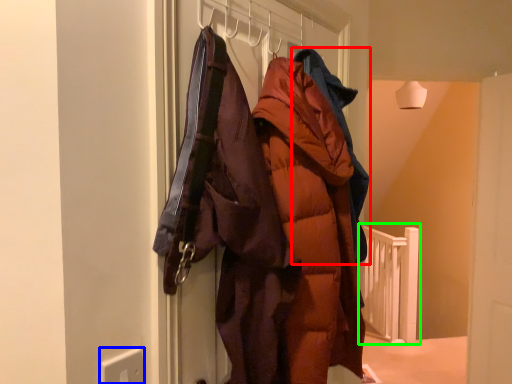
Question: Estimate the real-world distances between objects in this image. Which object is closer to jacket (highlighted by a red box), electric outlet (highlighted by a blue box) or rail (highlighted by a green box)?

Choices:
 (A) electric outlet
 (B) rail

Answer: (A)